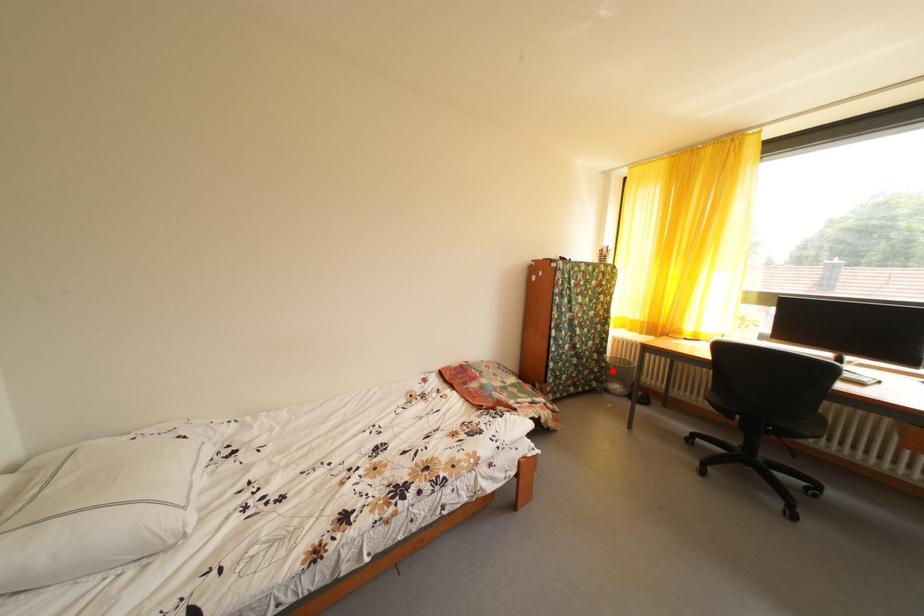
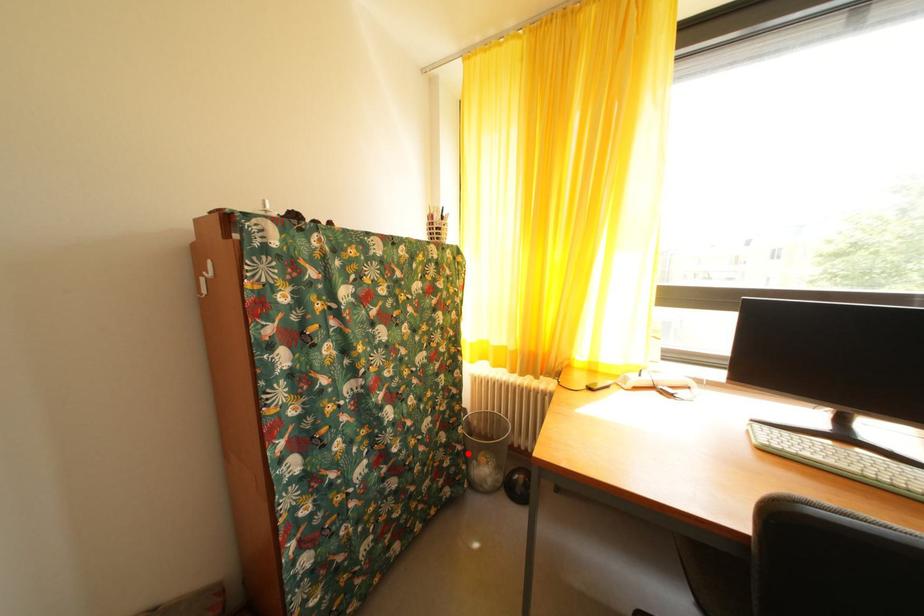
I am providing you with two images of the same scene from different viewpoints. A red point is marked on the first image and another point is marked on the second image. Are the points marked in image1 and image2 representing the same 3D position?

Yes